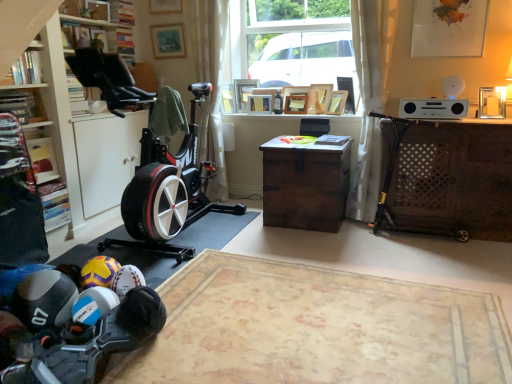
Where is `vacant region in front of wooden desk at right, the 1th desk in the right-to-left sequence`? The image size is (512, 384). vacant region in front of wooden desk at right, the 1th desk in the right-to-left sequence is located at coordinates (451, 263).